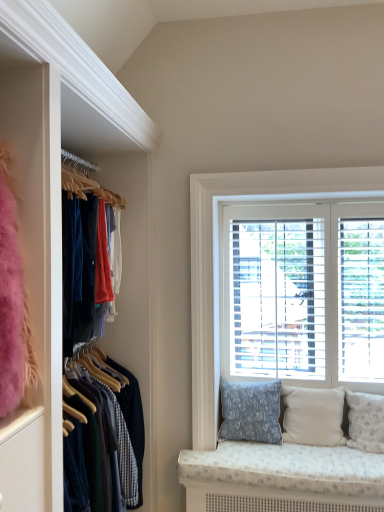
What do you see at coordinates (221, 253) in the screenshot? This screenshot has width=384, height=512. I see `white wood blinds at upper right` at bounding box center [221, 253].

This screenshot has height=512, width=384. Describe the element at coordinates (366, 421) in the screenshot. I see `white fabric pillow at lower right, positioned as the 3th pillow in left-to-right order` at that location.

Where is `blue floral fabric pillow at lower right, marked as the first pillow in a left-to-right arrangement`? blue floral fabric pillow at lower right, marked as the first pillow in a left-to-right arrangement is located at coordinates (251, 411).

Between white fabric pillow at lower right, acting as the first pillow starting from the right, and beige fabric pillow at lower right, positioned as the 2th pillow in right-to-left order, which one appears on the right side from the viewer's perspective?

white fabric pillow at lower right, acting as the first pillow starting from the right.

From a real-world perspective, who is located lower, white fabric pillow at lower right, acting as the first pillow starting from the right, or beige fabric pillow at lower right, placed as the 2th pillow when sorted from left to right?

white fabric pillow at lower right, acting as the first pillow starting from the right, is physically lower.

Consider the image. From the image's perspective, is white fabric pillow at lower right, positioned as the 3th pillow in left-to-right order, above beige fabric pillow at lower right, placed as the 2th pillow when sorted from left to right?

No.

I want to click on the 1st pillow to the left of the white fabric pillow at lower right, acting as the first pillow starting from the right, counting from the anchor's position, so click(x=313, y=416).

Who is bigger, beige fabric pillow at lower right, placed as the 2th pillow when sorted from left to right, or white fabric pillow at lower right, acting as the first pillow starting from the right?

With larger size is beige fabric pillow at lower right, placed as the 2th pillow when sorted from left to right.

From a real-world perspective, is beige fabric pillow at lower right, placed as the 2th pillow when sorted from left to right, physically below white fabric pillow at lower right, positioned as the 3th pillow in left-to-right order?

Actually, beige fabric pillow at lower right, placed as the 2th pillow when sorted from left to right, is physically above white fabric pillow at lower right, positioned as the 3th pillow in left-to-right order, in the real world.

Find the location of a particular element. The height and width of the screenshot is (512, 384). pillow located below the beige fabric pillow at lower right, positioned as the 2th pillow in right-to-left order (from the image's perspective) is located at coordinates (366, 421).

Can you confirm if beige fabric pillow at lower right, placed as the 2th pillow when sorted from left to right, is wider than white fabric pillow at lower right, acting as the first pillow starting from the right?

Result: No, beige fabric pillow at lower right, placed as the 2th pillow when sorted from left to right, is not wider than white fabric pillow at lower right, acting as the first pillow starting from the right.

Does blue floral fabric pillow at lower right, marked as the first pillow in a left-to-right arrangement, appear on the left side of beige fabric pillow at lower right, placed as the 2th pillow when sorted from left to right?

Indeed, blue floral fabric pillow at lower right, marked as the first pillow in a left-to-right arrangement, is positioned on the left side of beige fabric pillow at lower right, placed as the 2th pillow when sorted from left to right.

From the image's perspective, is blue floral fabric pillow at lower right, which is counted as the 3th pillow, starting from the right, over beige fabric pillow at lower right, placed as the 2th pillow when sorted from left to right?

Correct, blue floral fabric pillow at lower right, which is counted as the 3th pillow, starting from the right, appears higher than beige fabric pillow at lower right, placed as the 2th pillow when sorted from left to right, in the image.

In terms of height, does blue floral fabric pillow at lower right, marked as the first pillow in a left-to-right arrangement, look taller or shorter compared to beige fabric pillow at lower right, positioned as the 2th pillow in right-to-left order?

blue floral fabric pillow at lower right, marked as the first pillow in a left-to-right arrangement, is taller than beige fabric pillow at lower right, positioned as the 2th pillow in right-to-left order.

Is blue floral fabric pillow at lower right, which is counted as the 3th pillow, starting from the right, further to the viewer compared to beige fabric pillow at lower right, placed as the 2th pillow when sorted from left to right?

Yes, it is behind beige fabric pillow at lower right, placed as the 2th pillow when sorted from left to right.

From the image's perspective, is white wood blinds at upper right below beige fabric pillow at lower right, placed as the 2th pillow when sorted from left to right?

No.

Is white wood blinds at upper right far from beige fabric pillow at lower right, placed as the 2th pillow when sorted from left to right?

white wood blinds at upper right is near beige fabric pillow at lower right, placed as the 2th pillow when sorted from left to right, not far away.

Is white wood blinds at upper right smaller than beige fabric pillow at lower right, placed as the 2th pillow when sorted from left to right?

Incorrect, white wood blinds at upper right is not smaller in size than beige fabric pillow at lower right, placed as the 2th pillow when sorted from left to right.

Considering the sizes of objects white wood blinds at upper right and beige fabric pillow at lower right, positioned as the 2th pillow in right-to-left order, in the image provided, who is wider, white wood blinds at upper right or beige fabric pillow at lower right, positioned as the 2th pillow in right-to-left order,?

With larger width is beige fabric pillow at lower right, positioned as the 2th pillow in right-to-left order.

Is white fabric pillow at lower right, acting as the first pillow starting from the right, facing towards blue floral fabric pillow at lower right, which is counted as the 3th pillow, starting from the right?

No.

Who is taller, white fabric pillow at lower right, positioned as the 3th pillow in left-to-right order, or blue floral fabric pillow at lower right, marked as the first pillow in a left-to-right arrangement?

white fabric pillow at lower right, positioned as the 3th pillow in left-to-right order, is taller.

From the image's perspective, which object appears higher, white fabric pillow at lower right, positioned as the 3th pillow in left-to-right order, or blue floral fabric pillow at lower right, marked as the first pillow in a left-to-right arrangement?

blue floral fabric pillow at lower right, marked as the first pillow in a left-to-right arrangement, from the image's perspective.

Is blue floral fabric pillow at lower right, which is counted as the 3th pillow, starting from the right, facing towards white fabric pillow at lower right, positioned as the 3th pillow in left-to-right order?

No, blue floral fabric pillow at lower right, which is counted as the 3th pillow, starting from the right, is not aimed at white fabric pillow at lower right, positioned as the 3th pillow in left-to-right order.

Who is smaller, blue floral fabric pillow at lower right, which is counted as the 3th pillow, starting from the right, or white fabric pillow at lower right, acting as the first pillow starting from the right?

With smaller size is white fabric pillow at lower right, acting as the first pillow starting from the right.

From the image's perspective, which object appears higher, blue floral fabric pillow at lower right, which is counted as the 3th pillow, starting from the right, or white fabric pillow at lower right, positioned as the 3th pillow in left-to-right order?

blue floral fabric pillow at lower right, which is counted as the 3th pillow, starting from the right, is shown above in the image.

How different are the orientations of white fabric pillow at lower right, positioned as the 3th pillow in left-to-right order, and white wood blinds at upper right in degrees?

The facing directions of white fabric pillow at lower right, positioned as the 3th pillow in left-to-right order, and white wood blinds at upper right are 1.55 degrees apart.

From the image's perspective, is white fabric pillow at lower right, positioned as the 3th pillow in left-to-right order, beneath white wood blinds at upper right?

Indeed, from the image's perspective, white fabric pillow at lower right, positioned as the 3th pillow in left-to-right order, is shown beneath white wood blinds at upper right.

Is white fabric pillow at lower right, acting as the first pillow starting from the right, located outside white wood blinds at upper right?

Yes.

Is the surface of white fabric pillow at lower right, positioned as the 3th pillow in left-to-right order, in direct contact with white wood blinds at upper right?

They are not placed beside each other.

Where is `pillow on the right of the beige fabric pillow at lower right, placed as the 2th pillow when sorted from left to right`? The image size is (384, 512). pillow on the right of the beige fabric pillow at lower right, placed as the 2th pillow when sorted from left to right is located at coordinates (366, 421).

Where is `pillow below the beige fabric pillow at lower right, placed as the 2th pillow when sorted from left to right (from a real-world perspective)`? Image resolution: width=384 pixels, height=512 pixels. pillow below the beige fabric pillow at lower right, placed as the 2th pillow when sorted from left to right (from a real-world perspective) is located at coordinates (366, 421).

Looking at this image, from the image, which object appears to be nearer to beige fabric pillow at lower right, positioned as the 2th pillow in right-to-left order, white fabric pillow at lower right, acting as the first pillow starting from the right, or white wood blinds at upper right?

white fabric pillow at lower right, acting as the first pillow starting from the right, is closer to beige fabric pillow at lower right, positioned as the 2th pillow in right-to-left order.

Estimate the real-world distances between objects in this image. Which object is closer to white fabric pillow at lower right, positioned as the 3th pillow in left-to-right order, blue floral fabric pillow at lower right, marked as the first pillow in a left-to-right arrangement, or white wood blinds at upper right?

blue floral fabric pillow at lower right, marked as the first pillow in a left-to-right arrangement, is positioned closer to the anchor white fabric pillow at lower right, positioned as the 3th pillow in left-to-right order.

Estimate the real-world distances between objects in this image. Which object is closer to blue floral fabric pillow at lower right, marked as the first pillow in a left-to-right arrangement, beige fabric pillow at lower right, positioned as the 2th pillow in right-to-left order, or white fabric pillow at lower right, acting as the first pillow starting from the right?

Based on the image, beige fabric pillow at lower right, positioned as the 2th pillow in right-to-left order, appears to be nearer to blue floral fabric pillow at lower right, marked as the first pillow in a left-to-right arrangement.

Considering their positions, is blue floral fabric pillow at lower right, which is counted as the 3th pillow, starting from the right, positioned further to white wood blinds at upper right than beige fabric pillow at lower right, positioned as the 2th pillow in right-to-left order?

beige fabric pillow at lower right, positioned as the 2th pillow in right-to-left order, is positioned further to the anchor white wood blinds at upper right.

From the picture: Looking at the image, which one is located closer to white wood blinds at upper right, beige fabric pillow at lower right, positioned as the 2th pillow in right-to-left order, or blue floral fabric pillow at lower right, which is counted as the 3th pillow, starting from the right?

blue floral fabric pillow at lower right, which is counted as the 3th pillow, starting from the right, is closer to white wood blinds at upper right.

Based on the photo, estimate the real-world distances between objects in this image. Which object is closer to blue floral fabric pillow at lower right, marked as the first pillow in a left-to-right arrangement, beige fabric pillow at lower right, placed as the 2th pillow when sorted from left to right, or white wood blinds at upper right?

The object closer to blue floral fabric pillow at lower right, marked as the first pillow in a left-to-right arrangement, is beige fabric pillow at lower right, placed as the 2th pillow when sorted from left to right.

Estimate the real-world distances between objects in this image. Which object is closer to beige fabric pillow at lower right, placed as the 2th pillow when sorted from left to right, white wood blinds at upper right or blue floral fabric pillow at lower right, which is counted as the 3th pillow, starting from the right?

blue floral fabric pillow at lower right, which is counted as the 3th pillow, starting from the right.

From the image, which object appears to be nearer to white fabric pillow at lower right, positioned as the 3th pillow in left-to-right order, beige fabric pillow at lower right, placed as the 2th pillow when sorted from left to right, or white wood blinds at upper right?

beige fabric pillow at lower right, placed as the 2th pillow when sorted from left to right, lies closer to white fabric pillow at lower right, positioned as the 3th pillow in left-to-right order, than the other object.

Locate an element on the screen. pillow between white wood blinds at upper right and beige fabric pillow at lower right, positioned as the 2th pillow in right-to-left order, from top to bottom is located at coordinates (251, 411).

I want to click on pillow located between blue floral fabric pillow at lower right, marked as the first pillow in a left-to-right arrangement, and white fabric pillow at lower right, acting as the first pillow starting from the right, in the left-right direction, so click(x=313, y=416).